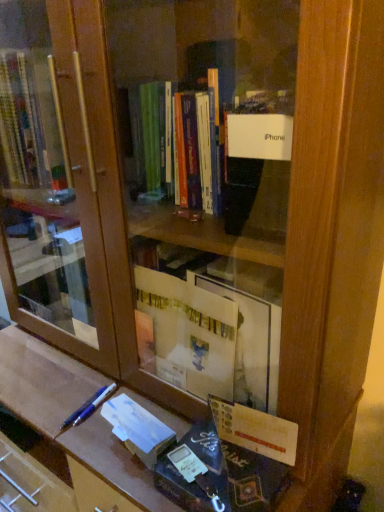
Where is `white matte paperback book at lower center`? The width and height of the screenshot is (384, 512). white matte paperback book at lower center is located at coordinates (137, 429).

Image resolution: width=384 pixels, height=512 pixels. What do you see at coordinates (137, 429) in the screenshot? I see `white matte paperback book at lower center` at bounding box center [137, 429].

From the picture: Measure the distance between blue metallic pen at lower left and camera.

The distance of blue metallic pen at lower left from camera is 34.02 inches.

What do you see at coordinates (89, 407) in the screenshot? I see `blue metallic pen at lower left` at bounding box center [89, 407].

Find the location of a particular element. blue metallic pen at lower left is located at coordinates (89, 407).

In order to face blue metallic pen at lower left, should I rotate leftwards or rightwards?

Answer: To face it directly, rotate left by 13.395 degrees.

Find the location of a particular element. This screenshot has width=384, height=512. white matte paperback book at lower center is located at coordinates (137, 429).

Considering the positions of objects blue metallic pen at lower left and white matte paperback book at lower center in the image provided, who is more to the left, blue metallic pen at lower left or white matte paperback book at lower center?

Positioned to the left is blue metallic pen at lower left.

Is blue metallic pen at lower left in front of or behind white matte paperback book at lower center in the image?

Visually, blue metallic pen at lower left is located behind white matte paperback book at lower center.

Which is further, (101,399) or (137,407)?

Positioned behind is point (101,399).

From the image's perspective, is blue metallic pen at lower left above or below white matte paperback book at lower center?

From the image's perspective, blue metallic pen at lower left appears above white matte paperback book at lower center.

From a real-world perspective, is blue metallic pen at lower left positioned above or below white matte paperback book at lower center?

From a real-world perspective, blue metallic pen at lower left is physically below white matte paperback book at lower center.

Considering the relative sizes of blue metallic pen at lower left and white matte paperback book at lower center in the image provided, is blue metallic pen at lower left thinner than white matte paperback book at lower center?

No.

Considering the relative sizes of blue metallic pen at lower left and white matte paperback book at lower center in the image provided, is blue metallic pen at lower left taller than white matte paperback book at lower center?

In fact, blue metallic pen at lower left may be shorter than white matte paperback book at lower center.

Which of these two, blue metallic pen at lower left or white matte paperback book at lower center, is bigger?

With larger size is white matte paperback book at lower center.

In the scene shown: Is blue metallic pen at lower left completely or partially outside of white matte paperback book at lower center?

Yes, blue metallic pen at lower left is outside of white matte paperback book at lower center.

Is blue metallic pen at lower left positioned far away from white matte paperback book at lower center?

That's not correct — blue metallic pen at lower left is a little close to white matte paperback book at lower center.

Based on the photo, is blue metallic pen at lower left aimed at white matte paperback book at lower center?

No.

Can you tell me how much blue metallic pen at lower left and white matte paperback book at lower center differ in facing direction?

The angle between the facing direction of blue metallic pen at lower left and the facing direction of white matte paperback book at lower center is 11.9 degrees.

Where is `pencil that appears above the white matte paperback book at lower center (from the image's perspective)`? The height and width of the screenshot is (512, 384). pencil that appears above the white matte paperback book at lower center (from the image's perspective) is located at coordinates (89, 407).

Which object is positioned more to the right, white matte paperback book at lower center or blue metallic pen at lower left?

From the viewer's perspective, white matte paperback book at lower center appears more on the right side.

Relative to blue metallic pen at lower left, is white matte paperback book at lower center in front or behind?

Clearly, white matte paperback book at lower center is in front of blue metallic pen at lower left.

Is point (117, 412) positioned behind point (97, 400)?

No, (117, 412) is closer to viewer.

From the image's perspective, which is above, white matte paperback book at lower center or blue metallic pen at lower left?

From the image's view, blue metallic pen at lower left is above.

From a real-world perspective, is white matte paperback book at lower center physically below blue metallic pen at lower left?

No, from a real-world perspective, white matte paperback book at lower center is not under blue metallic pen at lower left.

Considering the sizes of white matte paperback book at lower center and blue metallic pen at lower left in the image, is white matte paperback book at lower center wider or thinner than blue metallic pen at lower left?

white matte paperback book at lower center is thinner than blue metallic pen at lower left.

Considering the sizes of white matte paperback book at lower center and blue metallic pen at lower left in the image, is white matte paperback book at lower center taller or shorter than blue metallic pen at lower left?

Considering their sizes, white matte paperback book at lower center has more height than blue metallic pen at lower left.

Can you confirm if white matte paperback book at lower center is bigger than blue metallic pen at lower left?

Yes, white matte paperback book at lower center is bigger than blue metallic pen at lower left.

Is white matte paperback book at lower center spatially inside blue metallic pen at lower left, or outside of it?

white matte paperback book at lower center exists outside the volume of blue metallic pen at lower left.

Is the surface of white matte paperback book at lower center in direct contact with blue metallic pen at lower left?

No, white matte paperback book at lower center is not touching blue metallic pen at lower left.

Is white matte paperback book at lower center oriented away from blue metallic pen at lower left?

No, blue metallic pen at lower left is not at the back of white matte paperback book at lower center.

How distant is white matte paperback book at lower center from blue metallic pen at lower left?

A distance of 5.42 inches exists between white matte paperback book at lower center and blue metallic pen at lower left.

This screenshot has width=384, height=512. Find the location of `paperback book that appears above the blue metallic pen at lower left (from a real-world perspective)`. paperback book that appears above the blue metallic pen at lower left (from a real-world perspective) is located at coordinates click(x=137, y=429).

There is a blue metallic pen at lower left. Where is `paperback book above it (from a real-world perspective)`? Image resolution: width=384 pixels, height=512 pixels. paperback book above it (from a real-world perspective) is located at coordinates (137, 429).

Locate an element on the screen. The width and height of the screenshot is (384, 512). pencil to the left of white matte paperback book at lower center is located at coordinates (89, 407).